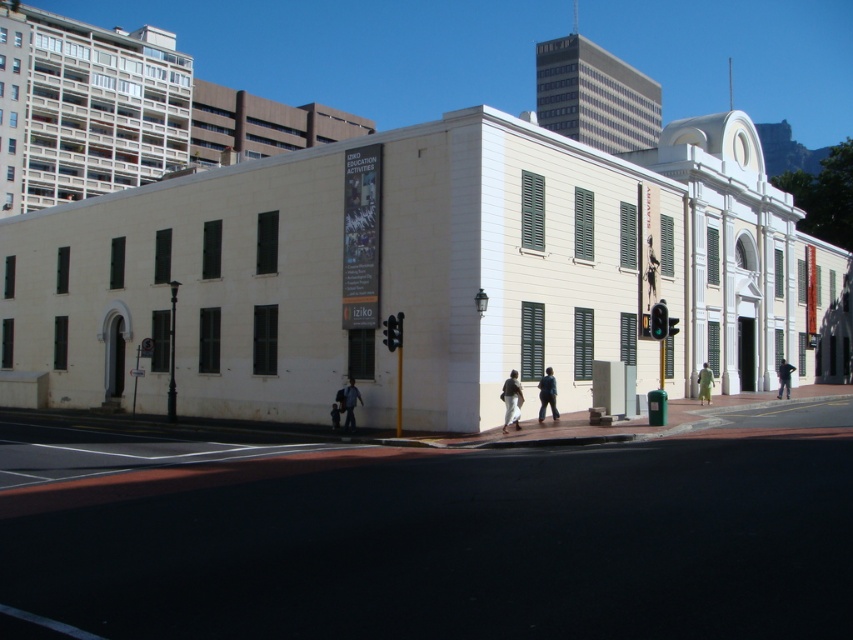
Based on the photo, you are a pedestrian waiting to cross the street. You notice two items on the ground in front of the historical building with dark green shutters. The items are a brown leather jacket at center and a light blue fabric at center. Which item is wider?

The brown leather jacket at center is wider than the light blue fabric at center.

You are a pedestrian waiting to cross the street. You see two people in the scene, one wearing a brown leather jacket at center and another wearing a green fabric dress at lower right. Which person is closer to the traffic light that is currently green?

The brown leather jacket at center is located above the green fabric dress at lower right, meaning the person in the brown leather jacket at center is closer to the traffic light.

You are a pedestrian standing at the crosswalk and see the brown leather jacket at center. If you want to reach the building, should you walk towards the traffic light or away from it?

Since the brown leather jacket at center is at point (511, 401), you should walk towards the traffic light to reach the building.